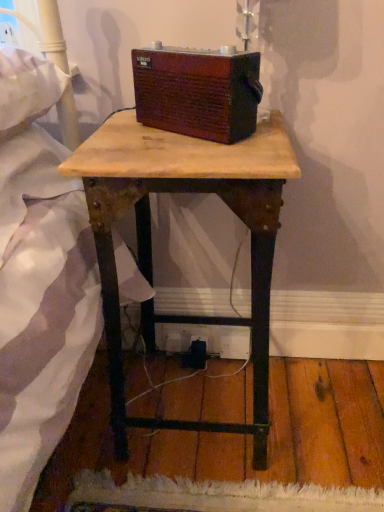
Where is `unoccupied region to the right of wooden table at center`? The image size is (384, 512). unoccupied region to the right of wooden table at center is located at coordinates (322, 412).